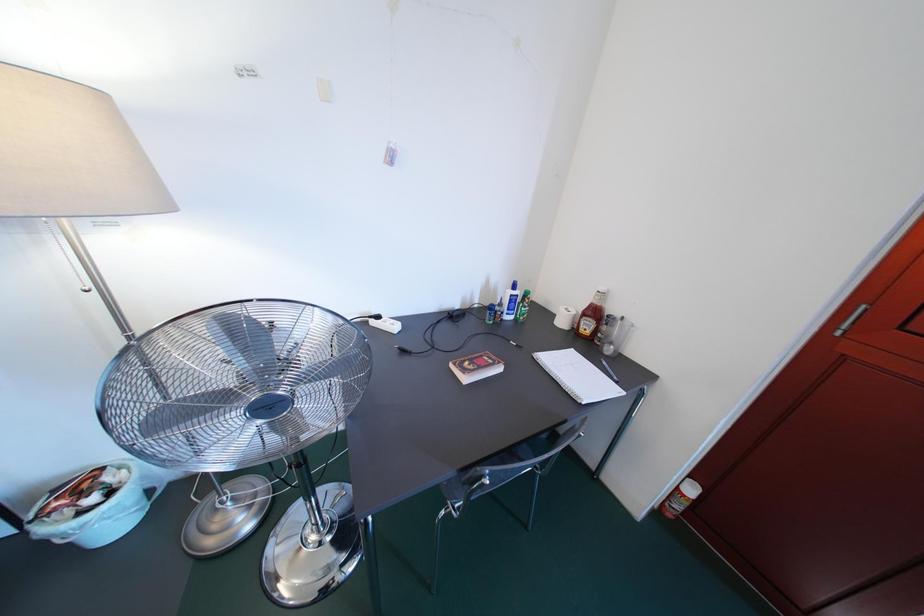
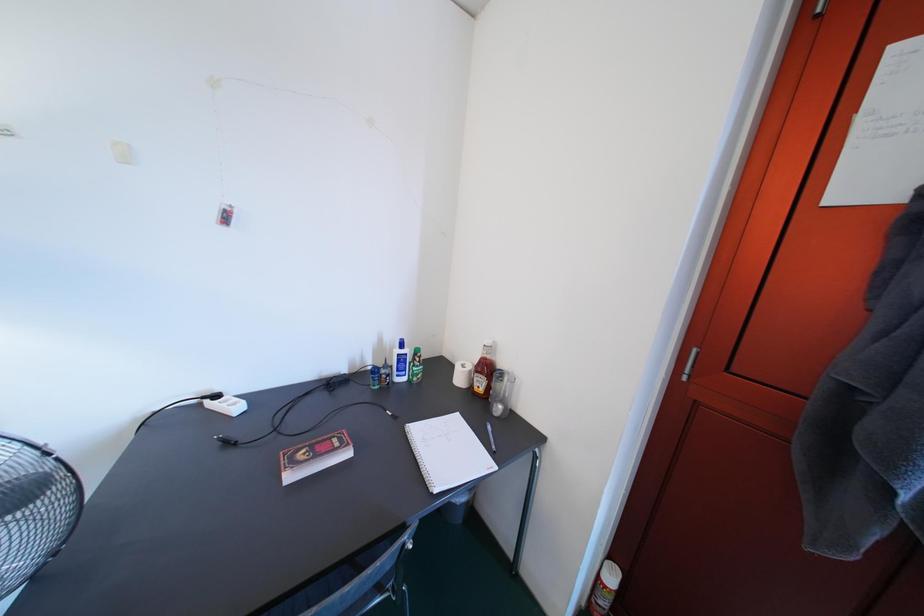
Question: How did the camera likely rotate?

Choices:
 (A) Left
 (B) Right
 (C) Up
 (D) Down

Answer: (C)